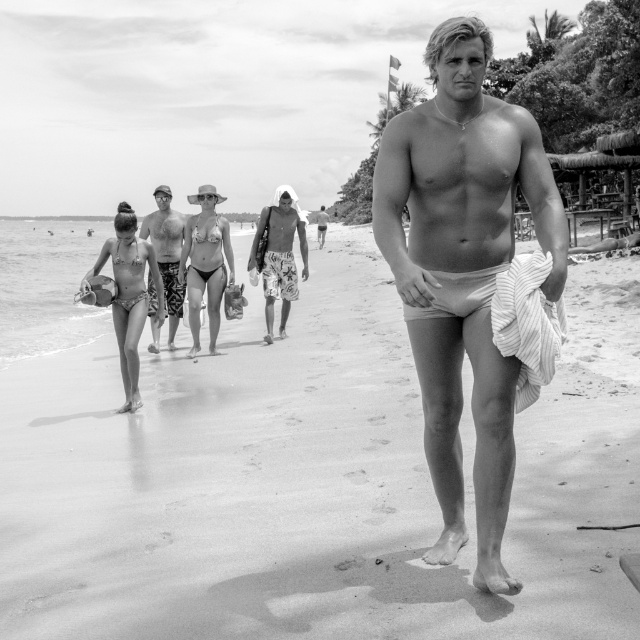
How far apart are smooth sand at center and patterned swim trunks at center?

smooth sand at center and patterned swim trunks at center are 3.39 meters apart from each other.

Is smooth sand at center below patterned swim trunks at center?

Indeed, smooth sand at center is positioned under patterned swim trunks at center.

Where is `smooth sand at center`? This screenshot has width=640, height=640. smooth sand at center is located at coordinates (312, 481).

Does white matte shorts at center have a lesser width compared to patterned swim trunks at center?

Indeed, white matte shorts at center has a lesser width compared to patterned swim trunks at center.

Does point (444, 342) come behind point (168, 259)?

No, (444, 342) is closer to viewer.

Does point (461, 112) come behind point (150, 320)?

No, it is in front of (150, 320).

Where is `white matte shorts at center`? Image resolution: width=640 pixels, height=640 pixels. white matte shorts at center is located at coordinates (464, 273).

Identify the location of smooth sand at center. (312, 481).

What do you see at coordinates (312, 481) in the screenshot?
I see `smooth sand at center` at bounding box center [312, 481].

This screenshot has height=640, width=640. Find the location of `smooth sand at center`. smooth sand at center is located at coordinates (312, 481).